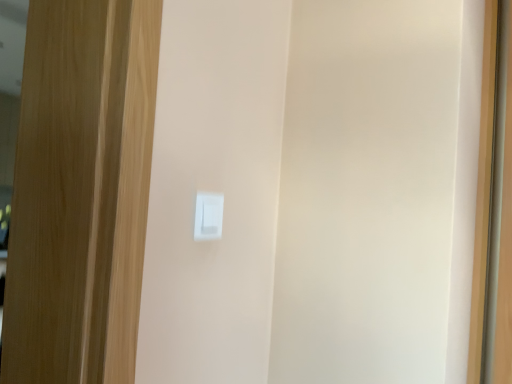
Identify the location of white plastic light switch at center. (208, 216).

Image resolution: width=512 pixels, height=384 pixels. What do you see at coordinates (208, 216) in the screenshot? I see `white plastic light switch at center` at bounding box center [208, 216].

Find the location of a particular element. This screenshot has width=512, height=384. white plastic light switch at center is located at coordinates (208, 216).